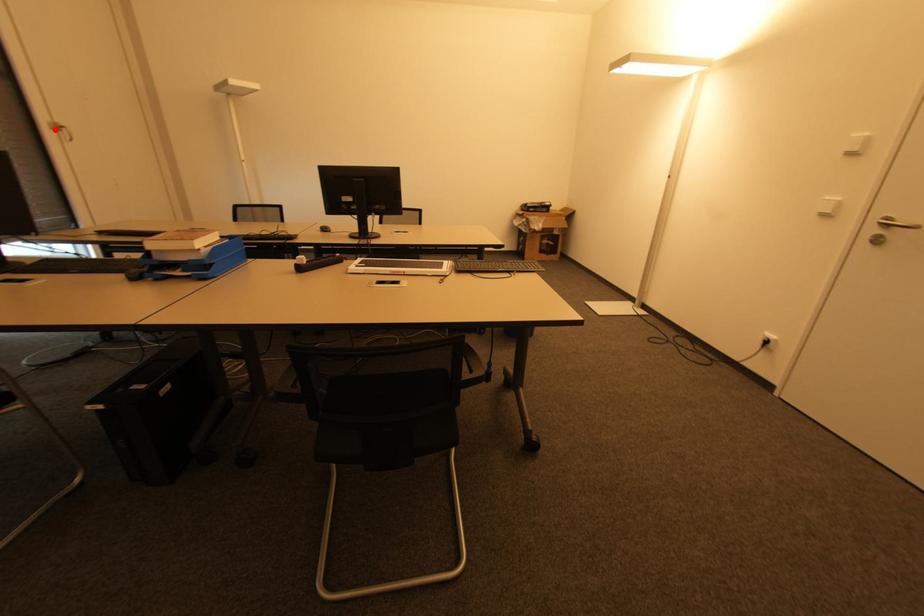
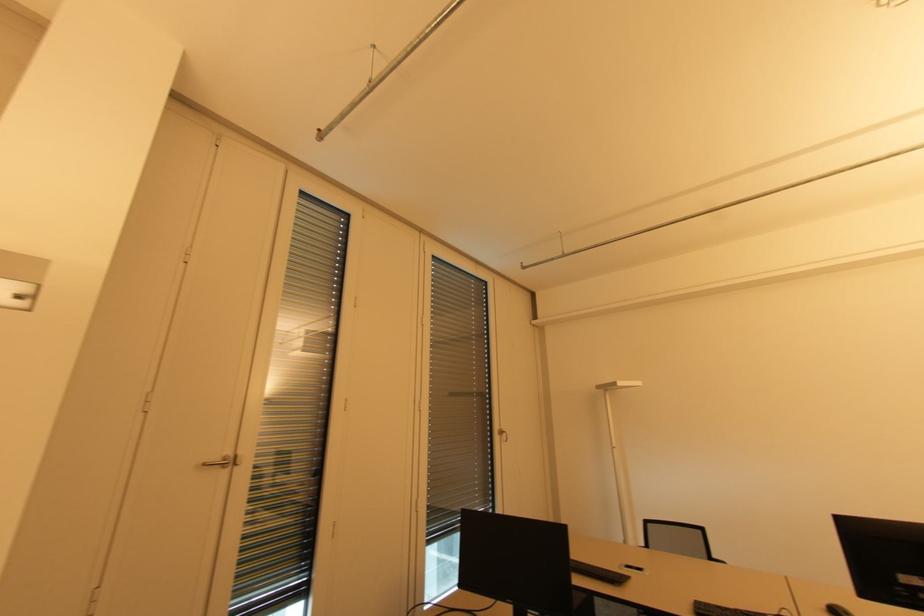
Find the pixel in the second image that matches the highlighted location in the first image.

(501, 435)